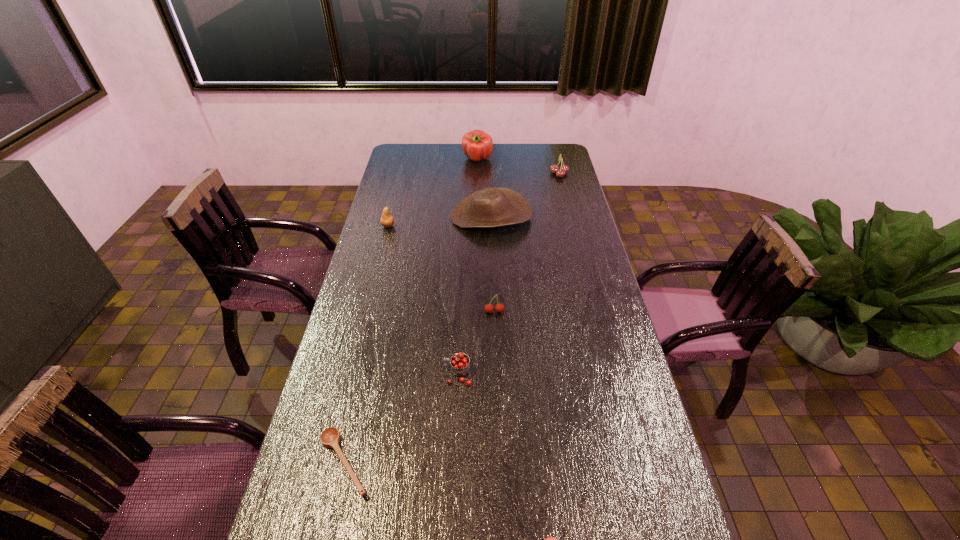
Image resolution: width=960 pixels, height=540 pixels. Find the location of `the shortest object`. the shortest object is located at coordinates (330, 437).

At what (x,y) coordinates should I click in order to perform the action: click on wooden spoon. Please return your answer as a coordinate pair (x, y). Image resolution: width=960 pixels, height=540 pixels. Looking at the image, I should click on (330, 437).

I want to click on vacant region located 0.050m on the back of the bell pepper, so click(477, 147).

At what (x,y) coordinates should I click in order to perform the action: click on vacant area situated on the back of the cowboy hat. Please return your answer as a coordinate pair (x, y). Looking at the image, I should click on (491, 192).

I want to click on free spot located on the front of the pear, so click(375, 278).

At what (x,y) coordinates should I click in order to perform the action: click on free space located 0.070m on the leaves of the rightmost object. Please return your answer as a coordinate pair (x, y). The height and width of the screenshot is (540, 960). Looking at the image, I should click on point(535,174).

In order to click on free region located 0.070m on the leaves of the rightmost object in this screenshot , I will do point(535,174).

In order to click on vacant area situated 0.170m on the leaves of the rightmost object in this screenshot , I will do `click(514, 174)`.

Find the location of a particular element. free space located 0.280m on the handle side of the leftmost cherry is located at coordinates (346, 374).

At what (x,y) coordinates should I click in order to perform the action: click on free space located 0.140m on the handle side of the leftmost cherry. Please return your answer as a coordinate pair (x, y). The height and width of the screenshot is (540, 960). Looking at the image, I should click on (394, 374).